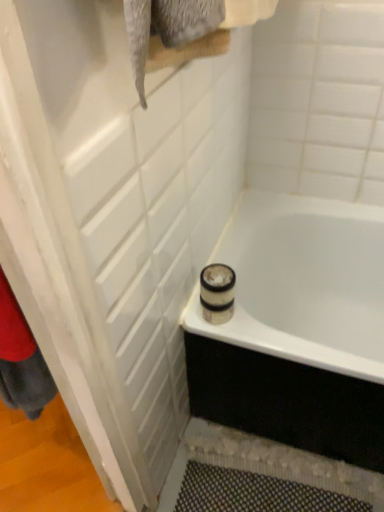
The height and width of the screenshot is (512, 384). What are the coordinates of `white textured screen door at upper left` in the screenshot? It's located at (114, 219).

This screenshot has width=384, height=512. What do you see at coordinates (114, 219) in the screenshot?
I see `white textured screen door at upper left` at bounding box center [114, 219].

This screenshot has width=384, height=512. Describe the element at coordinates (303, 283) in the screenshot. I see `white glossy bathtub at lower right` at that location.

This screenshot has height=512, width=384. What are the coordinates of `white glossy bathtub at lower right` in the screenshot? It's located at (303, 283).

The height and width of the screenshot is (512, 384). I want to click on white textured screen door at upper left, so click(114, 219).

Can you confirm if white glossy bathtub at lower right is positioned to the left of white textured screen door at upper left?

No, white glossy bathtub at lower right is not to the left of white textured screen door at upper left.

Does white glossy bathtub at lower right come behind white textured screen door at upper left?

Yes.

Does point (356, 249) come farther from viewer compared to point (77, 350)?

Yes, it is behind point (77, 350).

From the image's perspective, between white glossy bathtub at lower right and white textured screen door at upper left, who is located below?

white glossy bathtub at lower right is shown below in the image.

From a real-world perspective, is white glossy bathtub at lower right located higher than white textured screen door at upper left?

No, from a real-world perspective, white glossy bathtub at lower right is not above white textured screen door at upper left.

Does white glossy bathtub at lower right have a greater width compared to white textured screen door at upper left?

Correct, the width of white glossy bathtub at lower right exceeds that of white textured screen door at upper left.

Considering the relative sizes of white glossy bathtub at lower right and white textured screen door at upper left in the image provided, is white glossy bathtub at lower right shorter than white textured screen door at upper left?

Correct, white glossy bathtub at lower right is not as tall as white textured screen door at upper left.

Considering the sizes of objects white glossy bathtub at lower right and white textured screen door at upper left in the image provided, who is bigger, white glossy bathtub at lower right or white textured screen door at upper left?

With larger size is white glossy bathtub at lower right.

Is white glossy bathtub at lower right outside of white textured screen door at upper left?

Yes, white glossy bathtub at lower right is not within white textured screen door at upper left.

Is white glossy bathtub at lower right with white textured screen door at upper left?

white glossy bathtub at lower right is not next to white textured screen door at upper left, and they're not touching.

Is white glossy bathtub at lower right facing away from white textured screen door at upper left?

No, white glossy bathtub at lower right is not facing the opposite direction of white textured screen door at upper left.

How many degrees apart are the facing directions of white glossy bathtub at lower right and white textured screen door at upper left?

180 degrees separate the facing orientations of white glossy bathtub at lower right and white textured screen door at upper left.

Locate an element on the screen. Image resolution: width=384 pixels, height=512 pixels. bathtub behind the white textured screen door at upper left is located at coordinates (303, 283).

Considering the relative positions of white textured screen door at upper left and white glossy bathtub at lower right in the image provided, is white textured screen door at upper left to the left of white glossy bathtub at lower right from the viewer's perspective?

Yes, white textured screen door at upper left is to the left of white glossy bathtub at lower right.

Which is in front, white textured screen door at upper left or white glossy bathtub at lower right?

white textured screen door at upper left.

Is point (116, 302) behind point (314, 336)?

That is False.

From the image's perspective, relative to white glossy bathtub at lower right, is white textured screen door at upper left above or below?

From the image's perspective, white textured screen door at upper left appears above white glossy bathtub at lower right.

From a real-world perspective, between white textured screen door at upper left and white glossy bathtub at lower right, who is vertically lower?

white glossy bathtub at lower right, from a real-world perspective.

Is white textured screen door at upper left wider than white glossy bathtub at lower right?

No, white textured screen door at upper left is not wider than white glossy bathtub at lower right.

Considering the sizes of objects white textured screen door at upper left and white glossy bathtub at lower right in the image provided, who is shorter, white textured screen door at upper left or white glossy bathtub at lower right?

white glossy bathtub at lower right is shorter.

Who is bigger, white textured screen door at upper left or white glossy bathtub at lower right?

white glossy bathtub at lower right is bigger.

Is white textured screen door at upper left surrounding white glossy bathtub at lower right?

No.

Would you say white textured screen door at upper left is a long distance from white glossy bathtub at lower right?

That's not correct — white textured screen door at upper left is a little close to white glossy bathtub at lower right.

Does white textured screen door at upper left turn towards white glossy bathtub at lower right?

Yes, white textured screen door at upper left is oriented towards white glossy bathtub at lower right.

How different are the orientations of white textured screen door at upper left and white glossy bathtub at lower right in degrees?

The angular difference between white textured screen door at upper left and white glossy bathtub at lower right is 180 degrees.

Could you measure the distance between white textured screen door at upper left and white glossy bathtub at lower right?

The distance of white textured screen door at upper left from white glossy bathtub at lower right is 39.52 centimeters.

Where is `bathtub on the right of white textured screen door at upper left`? The height and width of the screenshot is (512, 384). bathtub on the right of white textured screen door at upper left is located at coordinates (303, 283).

You are a GUI agent. You are given a task and a screenshot of the screen. Output one action in this format:
    pyautogui.click(x=<x>, y=<y>)
    Task: Click on the screen door that is on the left side of white glossy bathtub at lower right
    The image size is (384, 512).
    Given the screenshot: What is the action you would take?
    tap(114, 219)

Where is `screen door that appears in front of the white glossy bathtub at lower right`? This screenshot has width=384, height=512. screen door that appears in front of the white glossy bathtub at lower right is located at coordinates (114, 219).